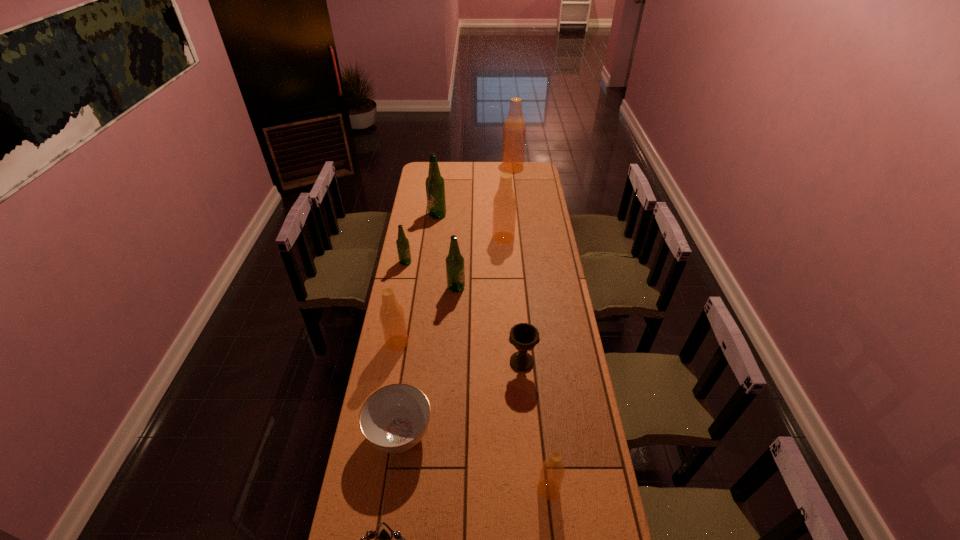
Image resolution: width=960 pixels, height=540 pixels. I want to click on the seventh nearest object, so click(x=403, y=247).

Find the location of `the fourth farthest beer bottle`. the fourth farthest beer bottle is located at coordinates (403, 247).

Find the location of a particular element. Image resolution: width=960 pixels, height=540 pixels. the second nearest object is located at coordinates (552, 472).

Where is `the smallest tan beer bottle`? The width and height of the screenshot is (960, 540). the smallest tan beer bottle is located at coordinates (552, 472).

Where is `chalice`? Image resolution: width=960 pixels, height=540 pixels. chalice is located at coordinates (523, 336).

At what (x,y) coordinates should I click in order to perform the action: click on the eighth tallest object. Please return your answer as a coordinate pair (x, y). Image resolution: width=960 pixels, height=540 pixels. Looking at the image, I should click on (523, 336).

Locate an element on the screen. This screenshot has height=540, width=960. the ninth tallest object is located at coordinates (393, 419).

Locate an element on the screen. chinaware is located at coordinates (393, 419).

Locate an element on the screen. vacant space located on the front of the farthest beer bottle is located at coordinates (514, 180).

Locate an element on the screen. The image size is (960, 540). free region located 0.330m on the label of the second green beer bottle from left to right is located at coordinates point(432,259).